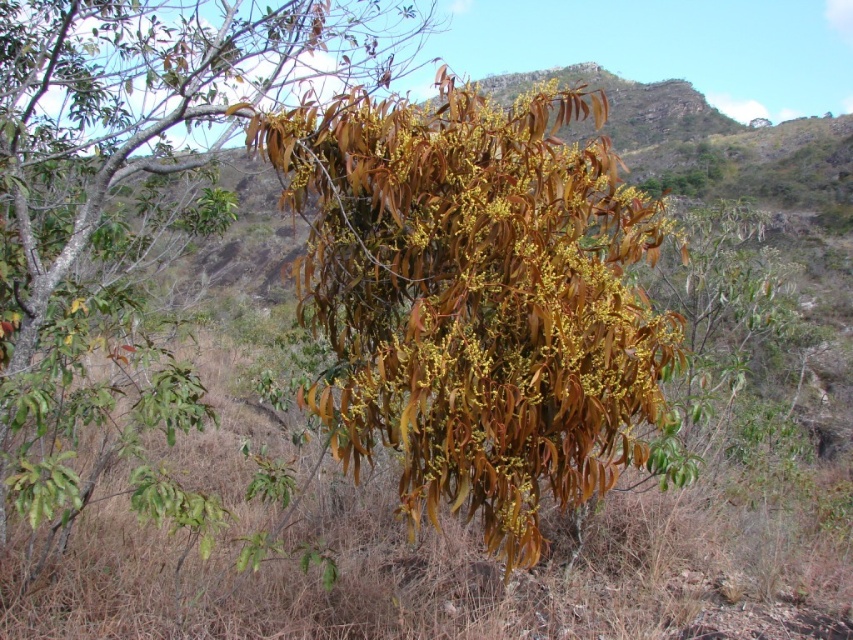
Question: Can you confirm if brown leathery leaves at center is smaller than leathery brown leaves at center?

Choices:
 (A) no
 (B) yes

Answer: (B)

Question: Is brown leathery leaves at center closer to camera compared to leathery brown leaves at center?

Choices:
 (A) yes
 (B) no

Answer: (A)

Question: Which point is farther from the camera taking this photo?

Choices:
 (A) (22, 332)
 (B) (334, 289)

Answer: (A)

Question: Which point is closer to the camera?

Choices:
 (A) (120, 445)
 (B) (514, 262)

Answer: (B)

Question: Is the position of brown leathery leaves at center less distant than that of leathery brown leaves at center?

Choices:
 (A) no
 (B) yes

Answer: (B)

Question: Among these points, which one is nearest to the camera?

Choices:
 (A) (467, 308)
 (B) (173, 220)

Answer: (A)